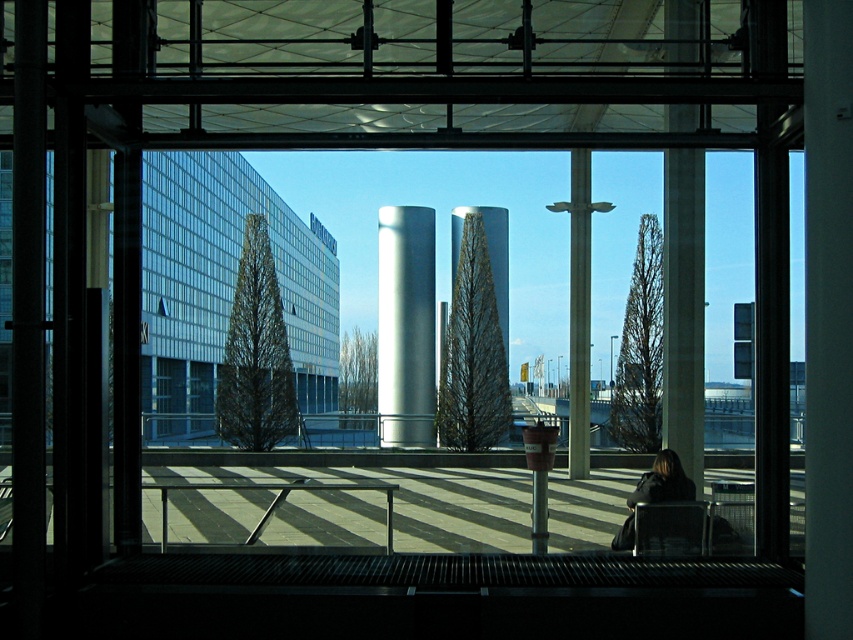
Question: Does satin silver cylinder at center have a larger size compared to matte black chair at lower right?

Choices:
 (A) no
 (B) yes

Answer: (A)

Question: Can you confirm if satin silver cylinder at center is positioned to the left of matte black chair at lower right?

Choices:
 (A) no
 (B) yes

Answer: (B)

Question: Estimate the real-world distances between objects in this image. Which object is farther from the matte black chair at lower right?

Choices:
 (A) satin silver cylinder at center
 (B) dark brown leather jacket at lower right

Answer: (A)

Question: Which point is farther from the camera taking this photo?

Choices:
 (A) (641, 544)
 (B) (401, 340)
 (C) (671, 497)

Answer: (B)

Question: In this image, where is satin silver cylinder at center located relative to dark brown leather jacket at lower right?

Choices:
 (A) left
 (B) right

Answer: (A)

Question: Which of these objects is positioned farthest from the satin silver cylinder at center?

Choices:
 (A) dark brown leather jacket at lower right
 (B) matte black chair at lower right

Answer: (B)